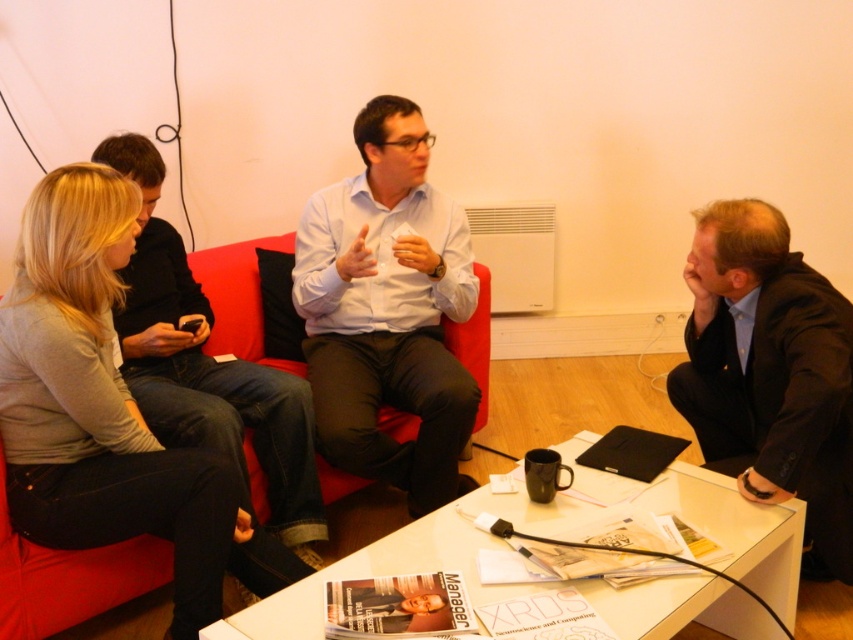
Does light gray sweater at left have a greater height compared to dark blue suit at right?

Yes, light gray sweater at left is taller than dark blue suit at right.

Does light gray sweater at left appear on the right side of dark blue suit at right?

No, light gray sweater at left is not to the right of dark blue suit at right.

At what (x,y) coordinates should I click in order to perform the action: click on light gray sweater at left. Please return your answer as a coordinate pair (x, y). Looking at the image, I should click on (108, 412).

Looking at this image, how far apart are light gray sweater at left and light blue shirt at center?

light gray sweater at left is 25.49 inches away from light blue shirt at center.

Which is more to the left, light gray sweater at left or light blue shirt at center?

light gray sweater at left

Identify the location of light gray sweater at left. The image size is (853, 640). (108, 412).

Can you confirm if light blue shirt at center is wider than dark blue suit at right?

Indeed, light blue shirt at center has a greater width compared to dark blue suit at right.

The height and width of the screenshot is (640, 853). I want to click on light blue shirt at center, so (x=387, y=310).